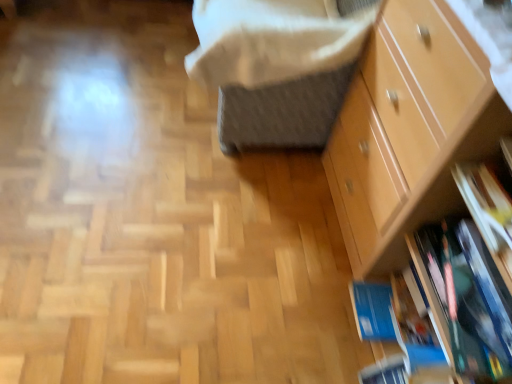
This screenshot has height=384, width=512. Describe the element at coordinates (461, 305) in the screenshot. I see `blue matte book at lower right` at that location.

Locate an element on the screen. The width and height of the screenshot is (512, 384). light brown wooden chest of drawers at right is located at coordinates pyautogui.click(x=409, y=131).

Who is smaller, white soft blanket at upper center or blue matte book at lower right?

Smaller between the two is blue matte book at lower right.

Is white soft blanket at upper center aimed at blue matte book at lower right?

No.

From a real-world perspective, which is physically above, white soft blanket at upper center or blue matte book at lower right?

From a 3D spatial view, white soft blanket at upper center is above.

Considering the sizes of objects light brown wooden chest of drawers at right and blue matte book at lower right in the image provided, who is wider, light brown wooden chest of drawers at right or blue matte book at lower right?

light brown wooden chest of drawers at right.

Is blue matte book at lower right located within light brown wooden chest of drawers at right?

Yes, blue matte book at lower right is surrounded by light brown wooden chest of drawers at right.

Is point (436, 167) positioned after point (459, 304)?

Yes, point (436, 167) is behind point (459, 304).

Are light brown wooden chest of drawers at right and blue matte book at lower right far apart?

light brown wooden chest of drawers at right is actually quite close to blue matte book at lower right.

Considering the relative sizes of blue matte book at lower right and white soft blanket at upper center in the image provided, is blue matte book at lower right wider than white soft blanket at upper center?

In fact, blue matte book at lower right might be narrower than white soft blanket at upper center.

From a real-world perspective, which is physically above, blue matte book at lower right or white soft blanket at upper center?

white soft blanket at upper center is physically above.

From the image's perspective, is blue matte book at lower right located beneath white soft blanket at upper center?

Correct, blue matte book at lower right appears lower than white soft blanket at upper center in the image.

Which of these two, light brown wooden chest of drawers at right or white soft blanket at upper center, is smaller?

white soft blanket at upper center.

What's the angular difference between light brown wooden chest of drawers at right and white soft blanket at upper center's facing directions?

The angular difference between light brown wooden chest of drawers at right and white soft blanket at upper center is 0.539 degrees.

Does light brown wooden chest of drawers at right come behind white soft blanket at upper center?

That is False.

Is light brown wooden chest of drawers at right not close to white soft blanket at upper center?

That's not correct — light brown wooden chest of drawers at right is a little close to white soft blanket at upper center.

From a real-world perspective, which object stands above the other?

light brown wooden chest of drawers at right.

Can you tell me how much blue matte book at lower right and light brown wooden chest of drawers at right differ in facing direction?

The angular difference between blue matte book at lower right and light brown wooden chest of drawers at right is 1.2 degrees.

Considering their positions, is blue matte book at lower right located in front of or behind light brown wooden chest of drawers at right?

blue matte book at lower right is behind light brown wooden chest of drawers at right.

Could you tell me if blue matte book at lower right is turned towards light brown wooden chest of drawers at right?

Yes, blue matte book at lower right is facing light brown wooden chest of drawers at right.

Is white soft blanket at upper center not close to light brown wooden chest of drawers at right?

No.

Could you measure the distance between white soft blanket at upper center and light brown wooden chest of drawers at right?

white soft blanket at upper center is 14.25 inches from light brown wooden chest of drawers at right.

Is white soft blanket at upper center located outside light brown wooden chest of drawers at right?

Yes, white soft blanket at upper center is outside of light brown wooden chest of drawers at right.

The height and width of the screenshot is (384, 512). Find the location of `book on the right of white soft blanket at upper center`. book on the right of white soft blanket at upper center is located at coordinates (461, 305).

Where is `the chest of drawers in front of the blue matte book at lower right`? the chest of drawers in front of the blue matte book at lower right is located at coordinates (409, 131).

When comparing their distances from blue matte book at lower right, does white soft blanket at upper center or light brown wooden chest of drawers at right seem further?

Among the two, white soft blanket at upper center is located further to blue matte book at lower right.

When comparing their distances from white soft blanket at upper center, does light brown wooden chest of drawers at right or blue matte book at lower right seem closer?

light brown wooden chest of drawers at right.

From the image, which object appears to be farther from blue matte book at lower right, light brown wooden chest of drawers at right or white soft blanket at upper center?

Among the two, white soft blanket at upper center is located further to blue matte book at lower right.

Based on their spatial positions, is blue matte book at lower right or light brown wooden chest of drawers at right closer to white soft blanket at upper center?

Based on the image, light brown wooden chest of drawers at right appears to be nearer to white soft blanket at upper center.

When comparing their distances from light brown wooden chest of drawers at right, does white soft blanket at upper center or blue matte book at lower right seem closer?

The object closer to light brown wooden chest of drawers at right is blue matte book at lower right.

Considering their positions, is blue matte book at lower right positioned further to light brown wooden chest of drawers at right than white soft blanket at upper center?

white soft blanket at upper center lies further to light brown wooden chest of drawers at right than the other object.

At what (x,y) coordinates should I click in order to perform the action: click on the chest of drawers between white soft blanket at upper center and blue matte book at lower right vertically. Please return your answer as a coordinate pair (x, y). Looking at the image, I should click on [409, 131].